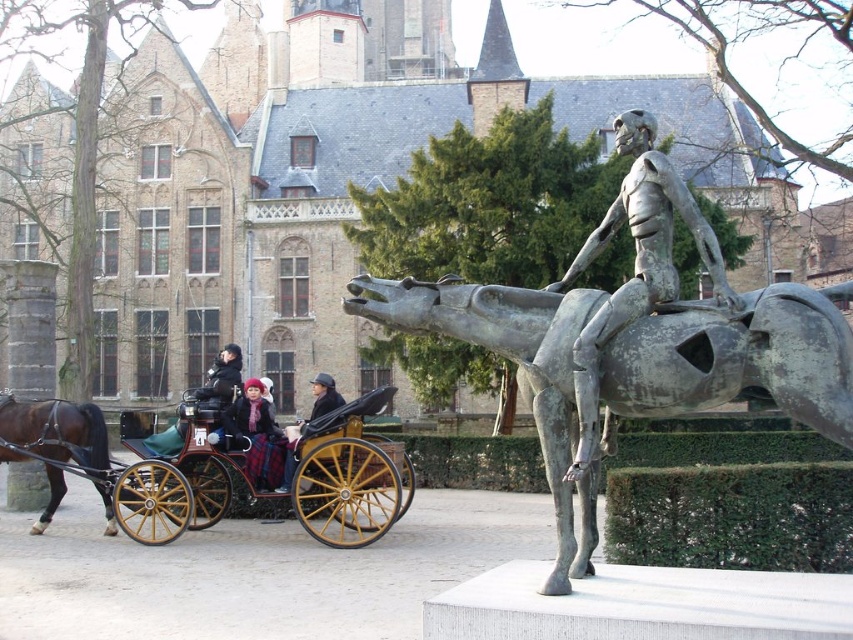
You are standing in the town square and want to take a photo of both the wooden polished cart at center and the matte black coat at center. Since you can only focus on one object at a time, which object should you focus on to ensure the other is still in the background?

You should focus on the wooden polished cart at center because it is closer to the viewer, allowing the matte black coat at center to remain in the background.

You are a tourist standing in the town square and want to take a photo of the matte black coat at center and the wooden polished cart at center. To ensure both are in the frame, which object should you position closer to the camera?

You should position the wooden polished cart at center closer to the camera because it is to the left of the matte black coat at center, so moving it forward will keep both in the frame.

You are a tourist in the European town square and want to take a photo of the wooden polished cart at center without the matte black coat at center blocking the view. Is the cart currently visible from your position?

The wooden polished cart at center is positioned under the matte black coat at center, so the cart is blocked by the coat and not visible from your current position.